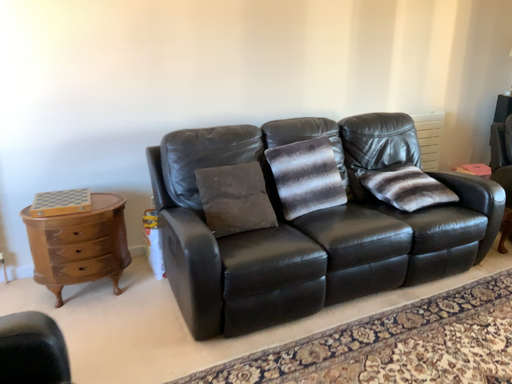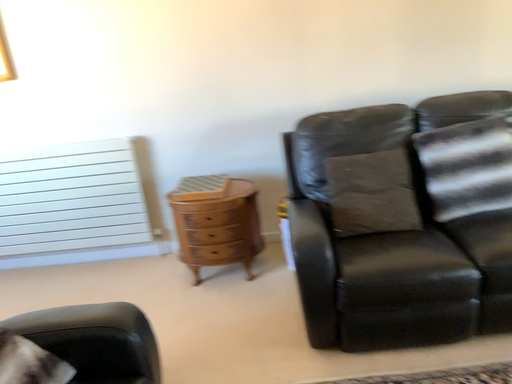
Question: How did the camera likely rotate when shooting the video?

Choices:
 (A) rotated left
 (B) rotated right

Answer: (A)